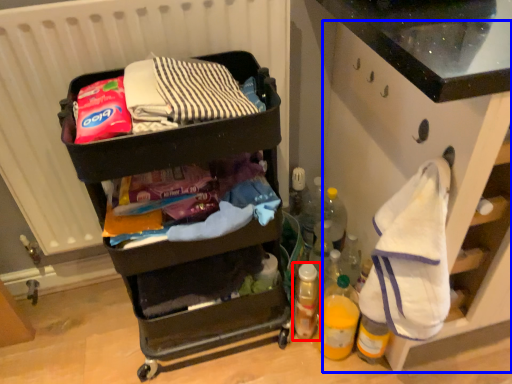
Question: Which object appears closest to the camera in this image, bottle (highlighted by a red box) or cabinetry (highlighted by a blue box)?

Choices:
 (A) bottle
 (B) cabinetry

Answer: (B)